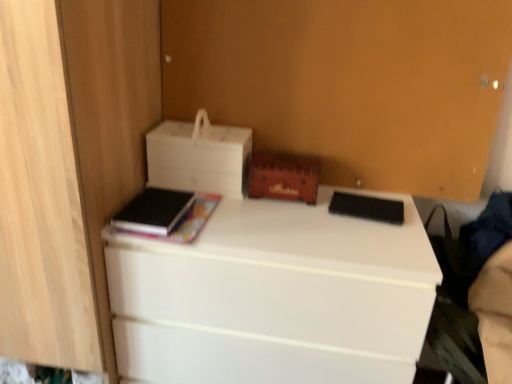
Find the location of a particular element. The height and width of the screenshot is (384, 512). empty space that is ontop of black matte book at left, the 2th paperback book positioned from the right is located at coordinates (147, 208).